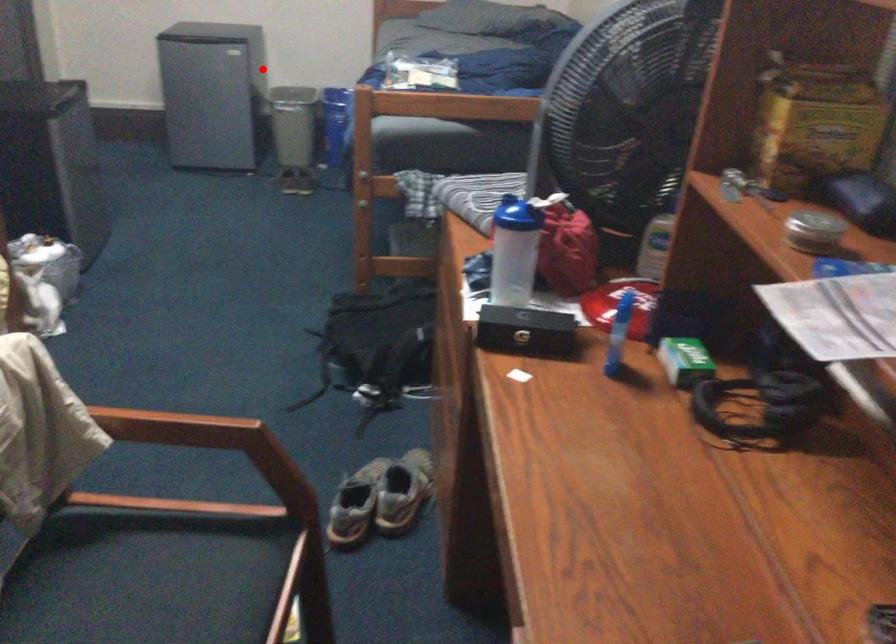
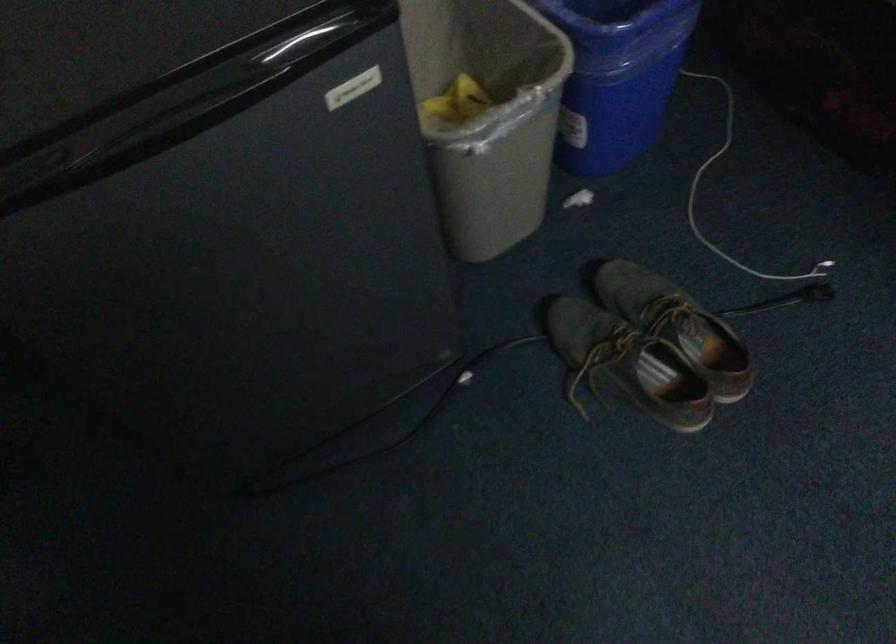
Find the pixel in the second image that matches the highlighted location in the first image.

(487, 115)